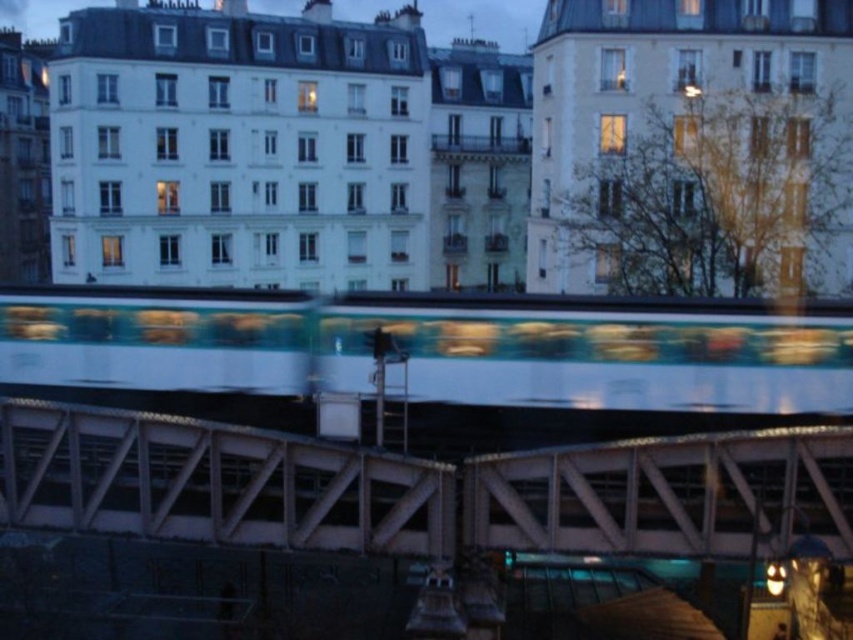
Identify the location of metallic bridge at center. The width and height of the screenshot is (853, 640). (213, 481).

Which is in front, point (322, 547) or point (811, 314)?

Point (322, 547) is more forward.

Which is in front, point (247, 458) or point (300, 291)?

Point (247, 458) is more forward.

Locate an element on the screen. Image resolution: width=853 pixels, height=640 pixels. metallic bridge at center is located at coordinates (213, 481).